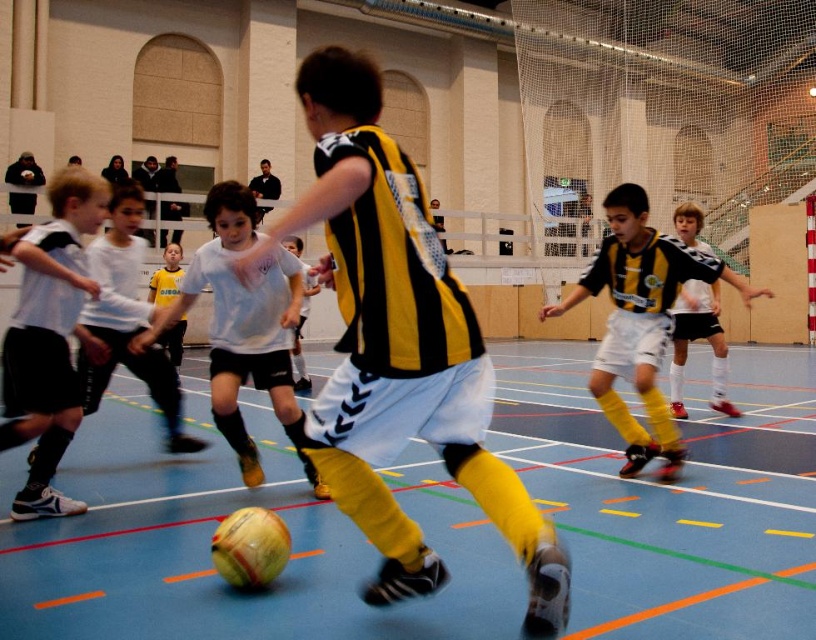
You are a referee in the gymnasium observing the soccer match. You notice two white items in the scene. One is the white matte shorts at left and the other is the white matte jersey at center. Which of these two items is positioned more to the left?

The white matte shorts at left is positioned more to the left than the white matte jersey at center.

You are a referee in the gymnasium and need to determine if the yellow and black jersey at center is wider than the yellow jersey at center. Based on the description, can you confirm this?

The yellow and black jersey at center is wider than the yellow jersey at center according to the description.